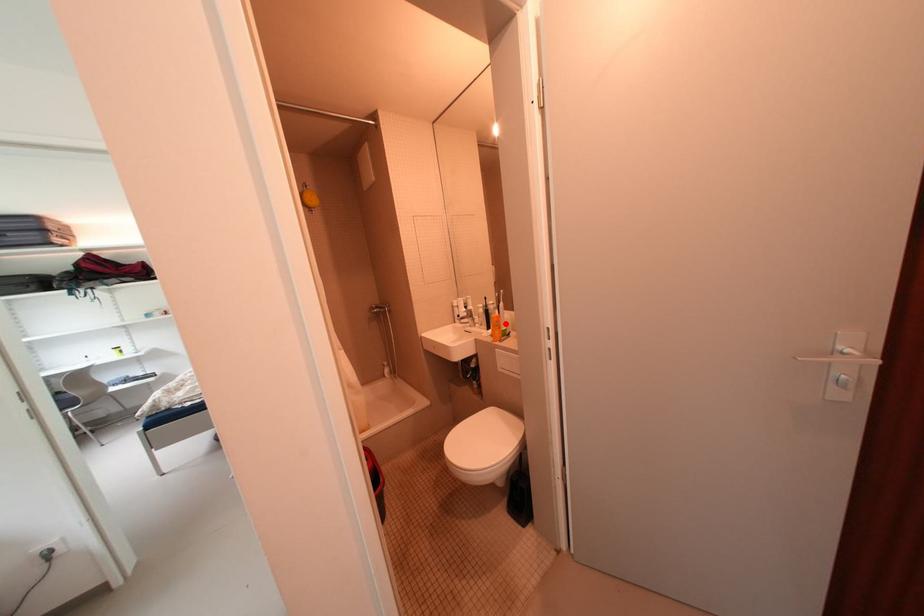
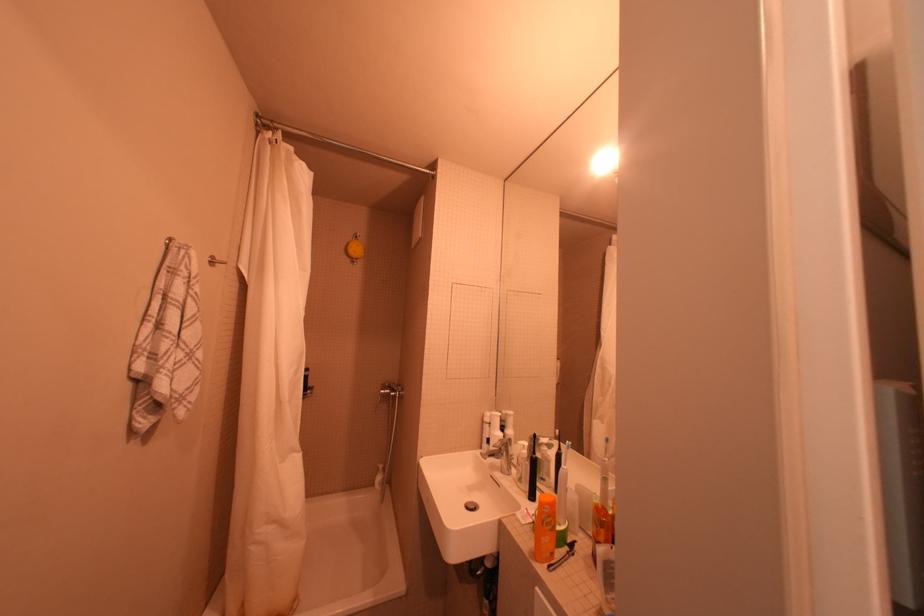
The point at the highlighted location is marked in the first image. Where is the corresponding point in the second image?

(556, 517)